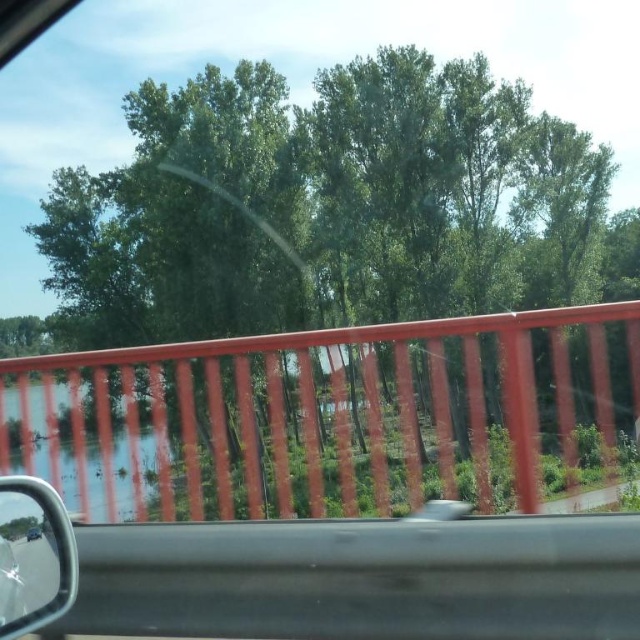
In the scene shown: You are driving a car and want to know if you can safely move a 3 meter long ladder horizontally between the smooth orange railing at center and the shiny black mirror at lower left. Can you fit the ladder between them without tilting it?

The smooth orange railing at center and shiny black mirror at lower left are 35.40 meters apart from each other. Since the ladder is only 3 meters long, there is more than enough space to fit it horizontally between them without tilting.

You are a passenger in the car and looking at the scene through the window. There are two points marked on the window, point (196, 467) and point (42, 532). Which point is closer to your eyes?

Point (42, 532) is closer to your eyes because it is nearer to the camera compared to point (196, 467), which is further away.